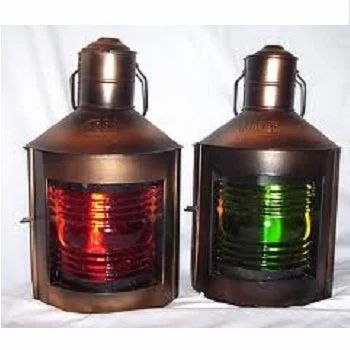
Where is `red bucket`? red bucket is located at coordinates (107, 210).